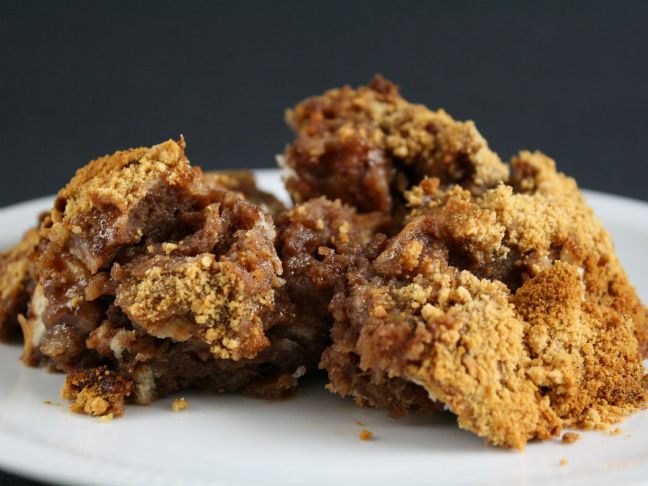
Locate an element on the screen. back edge of plate is located at coordinates (608, 193), (271, 171), (17, 206).